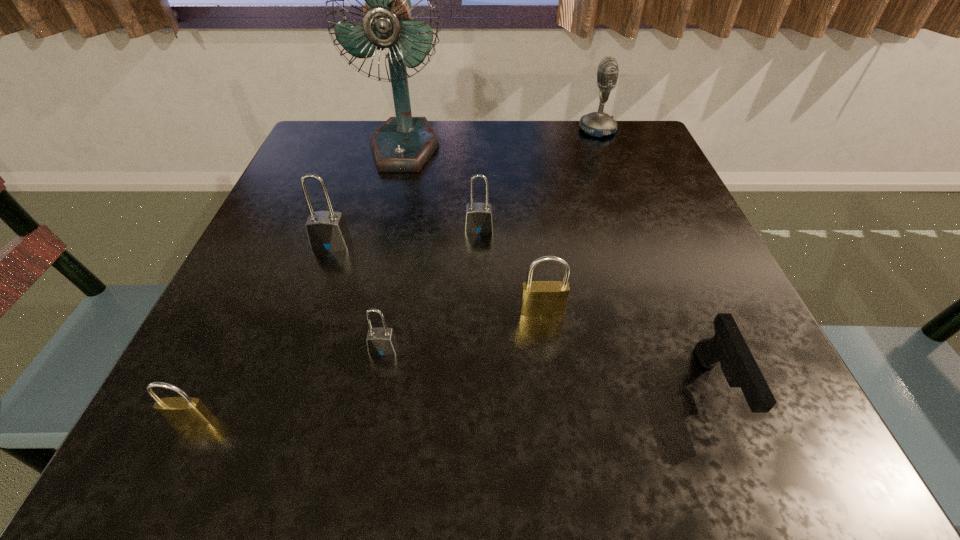
Where is `vacant region at the near right corner of the desktop`? Image resolution: width=960 pixels, height=540 pixels. vacant region at the near right corner of the desktop is located at coordinates (736, 423).

This screenshot has height=540, width=960. What are the coordinates of `vacant area that lies between the second gray padlock from right to left and the nearest padlock` in the screenshot? It's located at (288, 384).

I want to click on blank region between the microphone and the farthest gray padlock, so click(539, 179).

I want to click on vacant space that is in between the bigger brass padlock and the smallest gray padlock, so click(463, 330).

Find the location of a particular element. Image resolution: width=960 pixels, height=540 pixels. free space between the blue fan and the pistol is located at coordinates (561, 268).

Identify the location of vacant space that is in between the fourth padlock from left to right and the pistol. The height and width of the screenshot is (540, 960). (598, 309).

You are a GUI agent. You are given a task and a screenshot of the screen. Output one action in this format:
    pyautogui.click(x=<x>, y=<y>)
    Task: Click on the free spot between the nearer brass padlock and the second gray padlock from left to right
    
    Given the screenshot: What is the action you would take?
    pyautogui.click(x=288, y=384)

You are a GUI agent. You are given a task and a screenshot of the screen. Output one action in this format:
    pyautogui.click(x=<x>, y=<y>)
    Task: Click on the free space between the third padlock from left to right and the right brass padlock
    This screenshot has width=960, height=540.
    Given the screenshot: What is the action you would take?
    pyautogui.click(x=463, y=330)

This screenshot has width=960, height=540. Find the location of `free space between the tallest object and the tallest padlock`. free space between the tallest object and the tallest padlock is located at coordinates (368, 195).

Select which object is the third closest to the pistol. Please provide its 2D coordinates. Your answer should be formatted as a tuple, i.e. [(x, y)], where the tuple contains the x and y coordinates of a point satisfying the conditions above.

[(381, 341)]